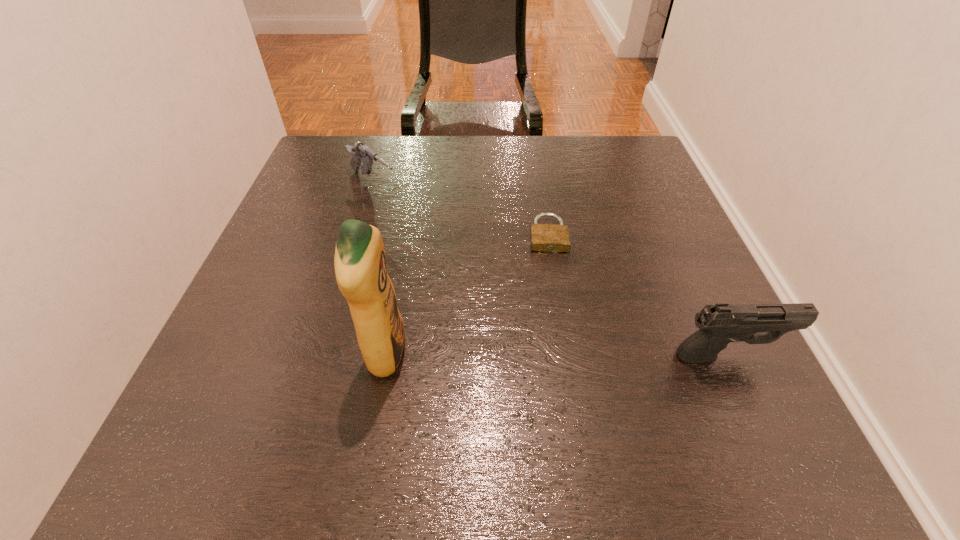
Where is `vacant space located 0.320m on the keyhole side of the padlock`? vacant space located 0.320m on the keyhole side of the padlock is located at coordinates (562, 386).

Locate an element on the screen. This screenshot has height=540, width=960. free space located on the keyhole side of the padlock is located at coordinates (552, 280).

I want to click on blank space located at the barrel of the leftmost object, so click(x=455, y=253).

Find the location of a particular element. The image size is (960, 540). vacant region located at the barrel of the leftmost object is located at coordinates [464, 260].

Identify the location of blank space located 0.110m at the barrel of the leftmost object. (417, 221).

The image size is (960, 540). Find the location of `object that is positioned at the far edge`. object that is positioned at the far edge is located at coordinates (360, 152).

Identify the location of detergent located at the near edge. This screenshot has height=540, width=960. (360, 263).

Where is `pistol located at the near edge`? pistol located at the near edge is located at coordinates (720, 324).

This screenshot has width=960, height=540. Identify the location of object situated at the left edge. (360, 152).

Where is `object present at the right edge`? This screenshot has width=960, height=540. object present at the right edge is located at coordinates (720, 324).